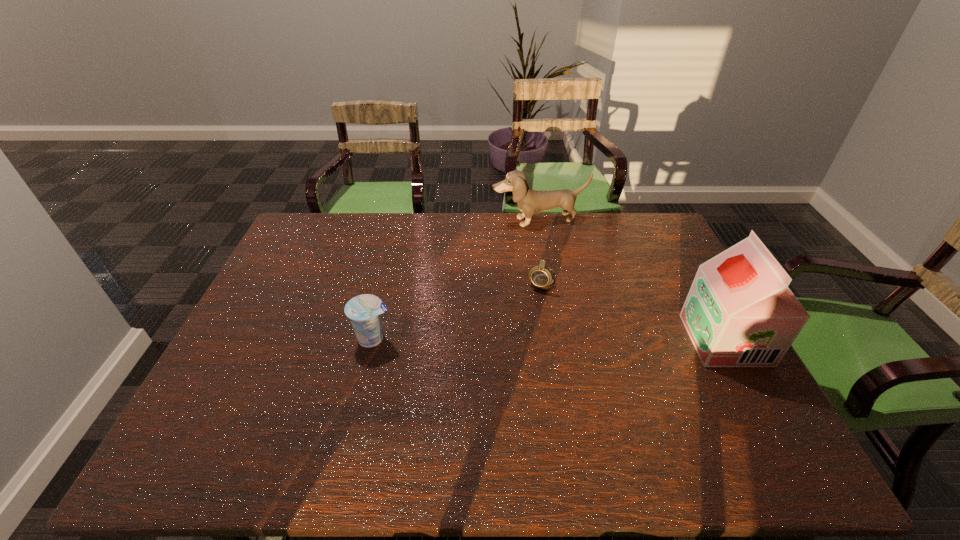
Where is `vacant space situated 0.110m at the face of the puppy`? This screenshot has height=540, width=960. vacant space situated 0.110m at the face of the puppy is located at coordinates (558, 248).

You are a GUI agent. You are given a task and a screenshot of the screen. Output one action in this format:
    pyautogui.click(x=<x>, y=<y>)
    Task: Click on the vacant space located 0.340m at the face of the puppy
    The image size is (960, 540).
    Given the screenshot: What is the action you would take?
    pyautogui.click(x=580, y=294)

Find the location of a particular element. free region located at the face of the puppy is located at coordinates (555, 242).

I want to click on free space located 0.320m on the face of the compass, so click(496, 374).

This screenshot has width=960, height=540. I want to click on vacant space located on the face of the compass, so click(487, 393).

The image size is (960, 540). I want to click on free space located 0.070m on the face of the compass, so click(x=529, y=308).

Identify the location of object located at the far edge. This screenshot has height=540, width=960. pos(529,201).

At what (x,y) coordinates should I click in order to perform the action: click on object positioned at the right edge. Please return your answer as a coordinate pair (x, y). This screenshot has width=960, height=540. Looking at the image, I should click on (739, 312).

Locate an element on the screen. vacant space at the far edge of the desktop is located at coordinates (409, 244).

Identify the location of vacant area at the near edge of the desktop. (264, 416).